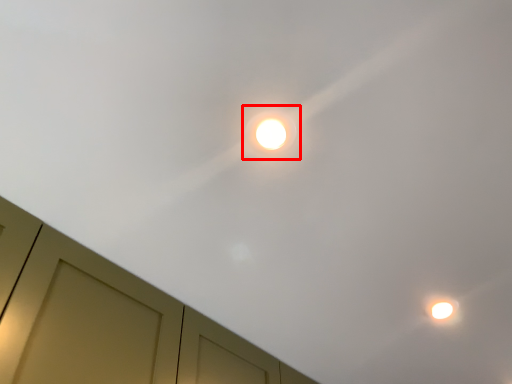
Question: From the image's perspective, where is droplight (annotated by the red box) located in relation to dresser in the image?

Choices:
 (A) below
 (B) above

Answer: (B)